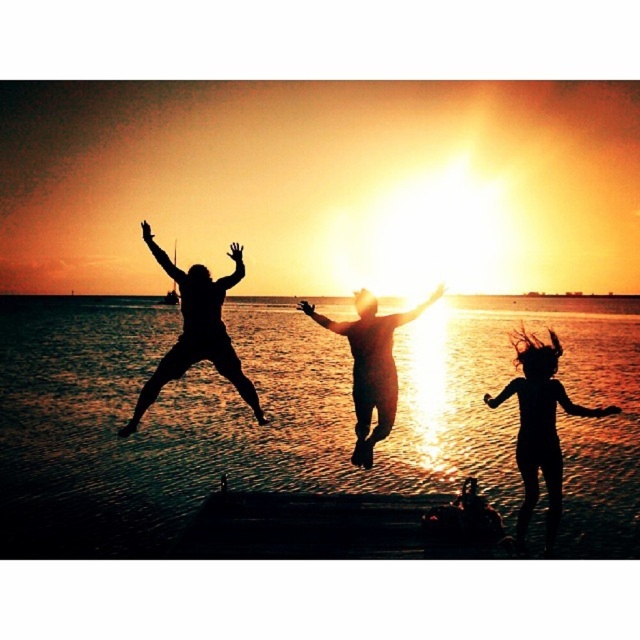
Question: Can you confirm if silvery water at center is positioned to the left of matte black person at center?

Choices:
 (A) no
 (B) yes

Answer: (B)

Question: Which point is closer to the camera?

Choices:
 (A) black matte person at center
 (B) silhouette hair at lower right
 (C) silvery water at center

Answer: (B)

Question: Does silvery water at center appear on the left side of matte black person at center?

Choices:
 (A) yes
 (B) no

Answer: (A)

Question: Which of the following is the farthest from the observer?

Choices:
 (A) silvery water at center
 (B) black matte person at center
 (C) matte black person at center

Answer: (A)

Question: Is silhouette hair at lower right thinner than black matte person at center?

Choices:
 (A) yes
 (B) no

Answer: (A)

Question: Which object is the closest to the silvery water at center?

Choices:
 (A) matte black person at center
 (B) black matte person at center

Answer: (A)